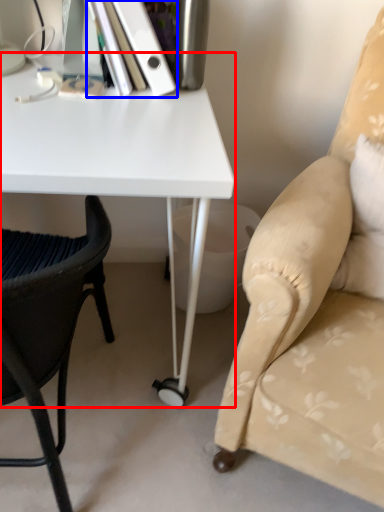
Question: Which object appears closest to the camera in this image, desk (highlighted by a red box) or paperback book (highlighted by a blue box)?

Choices:
 (A) desk
 (B) paperback book

Answer: (A)